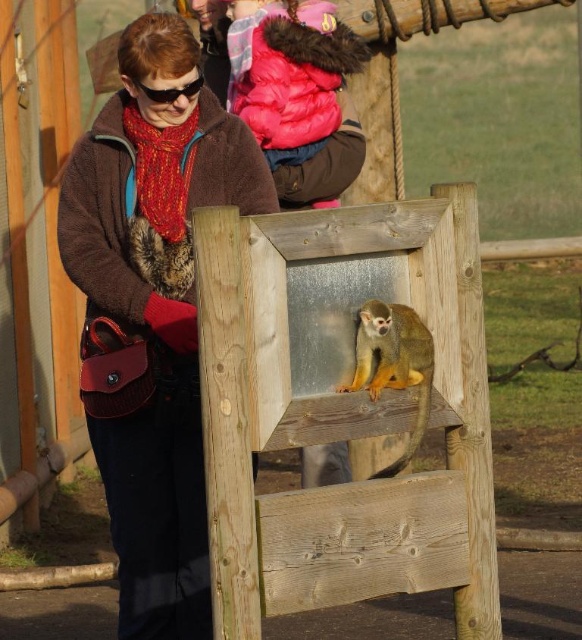
You are a zookeeper who needs to place a treat for the golden fur monkey at center. The treat must be placed to the left of the black plastic goggles at upper center. Can the treat be placed on the wooden structure where the monkey is currently perched?

The golden fur monkey at center is positioned on the right side of the black plastic goggles at upper center. Since the monkey is to the right of the goggles, placing the treat to the left of the goggles would be away from the monkey, so the wooden structure where the monkey is perched may not be the correct location. The treat should be placed to the left of the goggles, which might be a different area not occupied by the monkey.

You are a zookeeper standing at the entrance of the monkey enclosure and see two points marked in the scene. The first point is at coordinate point[143,467] and the second point is at coordinate point[416,426]. Which point is closer to you?

Point[143,467] is closer to you because it is further to the viewer than point[416,426].

You are standing in front of the wooden platform where the squirrel monkey is sitting. There are two points marked on the platform. The first point is at coordinate point (168, 304) and the second point is at coordinate point (175, 90). If you want to place a banana at the point closer to you, which coordinate should you choose?

You should choose point (175, 90) because it is closer to you than point (168, 304).